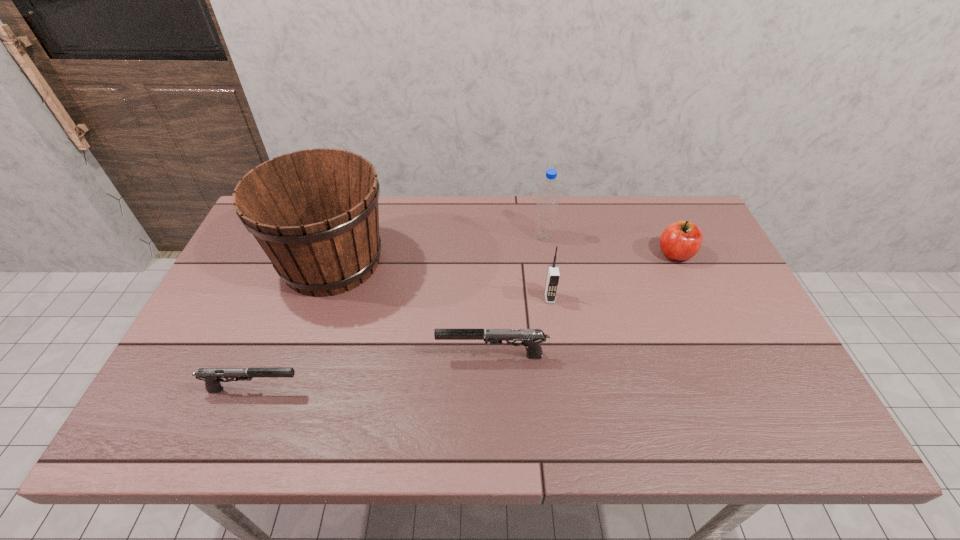
The width and height of the screenshot is (960, 540). I want to click on gun located at the left edge, so click(212, 376).

Where is `wine bucket that is positioned at the left edge`? The height and width of the screenshot is (540, 960). wine bucket that is positioned at the left edge is located at coordinates (315, 214).

The image size is (960, 540). I want to click on object located in the right edge section of the desktop, so pyautogui.click(x=680, y=241).

Identify the location of object at the far left corner. (315, 214).

Image resolution: width=960 pixels, height=540 pixels. I want to click on object that is positioned at the near left corner, so click(x=212, y=376).

The image size is (960, 540). I want to click on object that is at the far right corner, so click(680, 241).

Locate an element on the screen. The image size is (960, 540). vacant space at the far edge of the desktop is located at coordinates (489, 197).

This screenshot has height=540, width=960. In the image, there is a desktop. Identify the location of vacant space at the left edge. (280, 287).

In the image, there is a desktop. What are the coordinates of `vacant space at the near left corner` in the screenshot? It's located at coord(179,387).

At what (x,y) coordinates should I click in order to perform the action: click on free space between the third tallest object and the nearer gun. Please return your answer as a coordinate pair (x, y). This screenshot has width=960, height=540. Looking at the image, I should click on (401, 343).